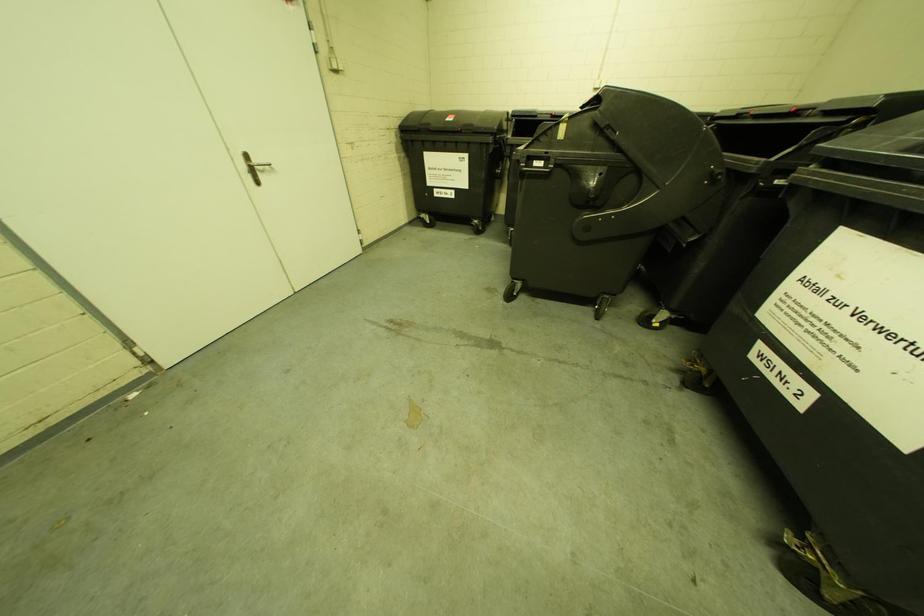
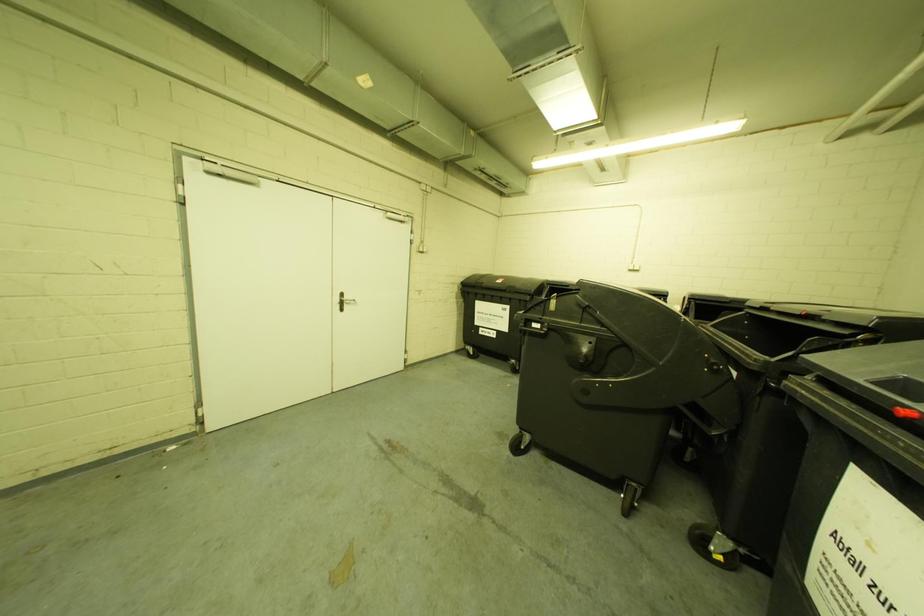
First-person continuous shooting, in which direction is the camera rotating?

The camera's rotation is toward left-up.